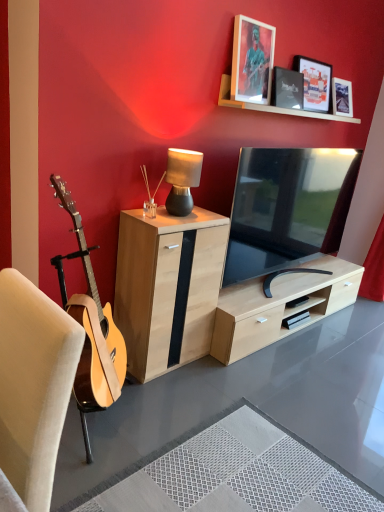
Question: Does natural wood cabinet at center lie behind matte black picture frame at upper center, which appears as the third picture frame when viewed from the left?

Choices:
 (A) yes
 (B) no

Answer: (B)

Question: Considering the relative sizes of natural wood cabinet at center and matte black picture frame at upper center, which ranks as the 1th picture frame in right-to-left order, in the image provided, is natural wood cabinet at center thinner than matte black picture frame at upper center, which ranks as the 1th picture frame in right-to-left order,?

Choices:
 (A) no
 (B) yes

Answer: (A)

Question: From the image's perspective, is natural wood cabinet at center below matte black picture frame at upper center, which appears as the third picture frame when viewed from the left?

Choices:
 (A) yes
 (B) no

Answer: (A)

Question: Does natural wood cabinet at center have a lesser height compared to matte black picture frame at upper center, which appears as the third picture frame when viewed from the left?

Choices:
 (A) yes
 (B) no

Answer: (B)

Question: Is the position of natural wood cabinet at center less distant than that of matte black picture frame at upper center, which ranks as the 1th picture frame in right-to-left order?

Choices:
 (A) yes
 (B) no

Answer: (A)

Question: Is matte black picture frame at upper center, which ranks as the 1th picture frame in right-to-left order, inside natural wood cabinet at center?

Choices:
 (A) no
 (B) yes

Answer: (A)

Question: From the image's perspective, is beige fabric chair at left below matte black tv at center?

Choices:
 (A) no
 (B) yes

Answer: (B)

Question: Can you confirm if beige fabric chair at left is positioned to the right of matte black tv at center?

Choices:
 (A) no
 (B) yes

Answer: (A)

Question: Is beige fabric chair at left taller than matte black tv at center?

Choices:
 (A) no
 (B) yes

Answer: (B)

Question: Considering the relative positions of beige fabric chair at left and matte black tv at center in the image provided, is beige fabric chair at left to the left of matte black tv at center from the viewer's perspective?

Choices:
 (A) yes
 (B) no

Answer: (A)

Question: Is beige fabric chair at left far away from matte black tv at center?

Choices:
 (A) yes
 (B) no

Answer: (A)

Question: Can you confirm if beige fabric chair at left is bigger than matte black tv at center?

Choices:
 (A) no
 (B) yes

Answer: (A)

Question: Does matte black picture frame at upper center, which appears as the third picture frame when viewed from the left, have a lesser width compared to matte black table lamp at center?

Choices:
 (A) no
 (B) yes

Answer: (B)